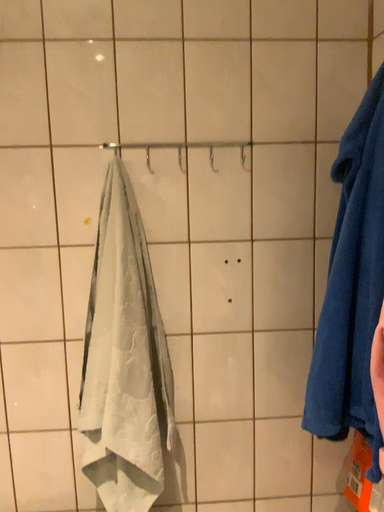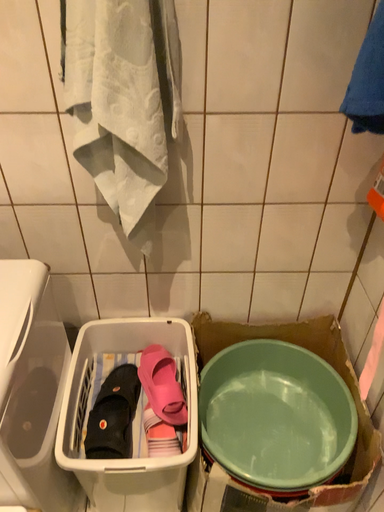
Question: How did the camera likely rotate when shooting the video?

Choices:
 (A) rotated downward
 (B) rotated upward

Answer: (A)